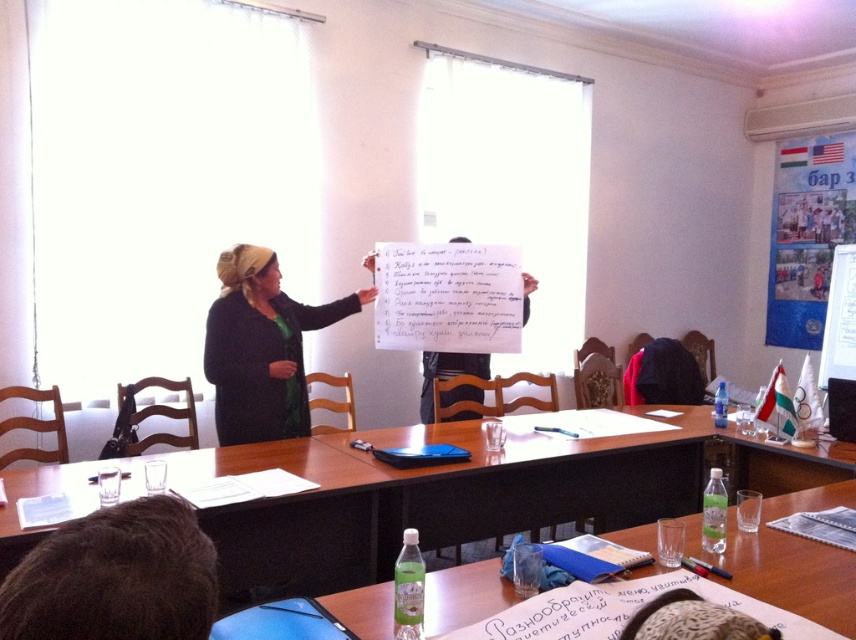
Question: Which point is farther to the camera?

Choices:
 (A) white paper at center
 (B) blue fabric banner at upper right
 (C) dark green fabric headscarf at center
 (D) brown wooden table at center

Answer: (B)

Question: Among these points, which one is nearest to the camera?

Choices:
 (A) (349, 314)
 (B) (816, 173)

Answer: (A)

Question: Is dark green fabric headscarf at center closer to the viewer compared to white paper at center?

Choices:
 (A) yes
 (B) no

Answer: (A)

Question: Can you confirm if wooden table at center is thinner than white paper at center?

Choices:
 (A) yes
 (B) no

Answer: (B)

Question: Which object is closer to the camera taking this photo?

Choices:
 (A) wooden table at center
 (B) dark green fabric headscarf at center
 (C) brown wooden table at center
 (D) blue fabric banner at upper right

Answer: (A)

Question: Can you confirm if wooden table at center is smaller than dark green fabric headscarf at center?

Choices:
 (A) yes
 (B) no

Answer: (A)